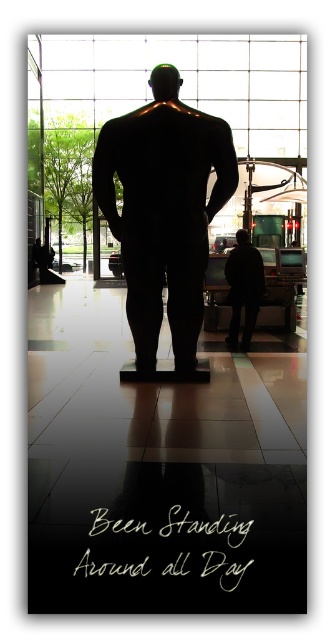
Who is positioned more to the left, black matte mannequin at center or dark matte figure at center?

Positioned to the left is black matte mannequin at center.

Is black matte mannequin at center above dark matte figure at center?

Indeed, black matte mannequin at center is positioned over dark matte figure at center.

Where is `black matte mannequin at center`? The image size is (330, 640). black matte mannequin at center is located at coordinates (164, 211).

In order to click on black matte mannequin at center in this screenshot , I will do `click(164, 211)`.